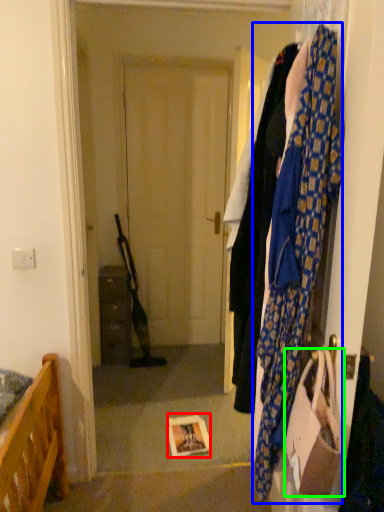
Question: Which is nearer to the book (highlighted by a red box)? scarf (highlighted by a blue box) or handbag (highlighted by a green box).

Choices:
 (A) scarf
 (B) handbag

Answer: (B)